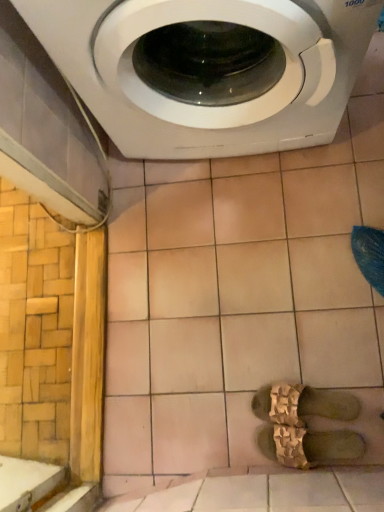
What are the coordinates of `vacant space to the right of brown textured sandals at center, acting as the first shoe starting from the bottom` in the screenshot? It's located at (349, 373).